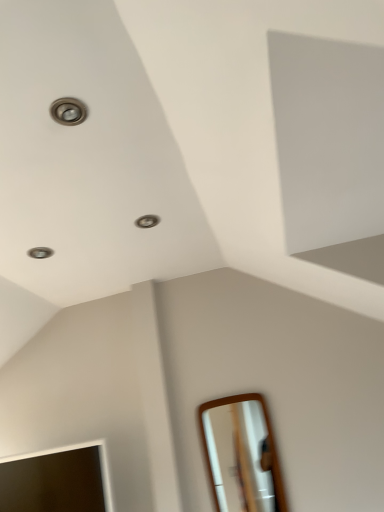
Question: Can you confirm if white glossy mirror at lower right, marked as the first mirror in a right-to-left arrangement, is thinner than matte wooden mirror at lower left, placed as the second mirror when sorted from right to left?

Choices:
 (A) yes
 (B) no

Answer: (A)

Question: Can you confirm if white glossy mirror at lower right, the second mirror viewed from the left, is positioned to the left of matte wooden mirror at lower left, which is the first mirror in left-to-right order?

Choices:
 (A) no
 (B) yes

Answer: (A)

Question: From a real-world perspective, is white glossy mirror at lower right, marked as the first mirror in a right-to-left arrangement, under matte wooden mirror at lower left, placed as the second mirror when sorted from right to left?

Choices:
 (A) yes
 (B) no

Answer: (A)

Question: Can you confirm if white glossy mirror at lower right, marked as the first mirror in a right-to-left arrangement, is positioned to the right of matte wooden mirror at lower left, which is the first mirror in left-to-right order?

Choices:
 (A) yes
 (B) no

Answer: (A)

Question: From a real-world perspective, is white glossy mirror at lower right, marked as the first mirror in a right-to-left arrangement, over matte wooden mirror at lower left, placed as the second mirror when sorted from right to left?

Choices:
 (A) no
 (B) yes

Answer: (A)

Question: From the image's perspective, is white glossy mirror at lower right, marked as the first mirror in a right-to-left arrangement, over matte wooden mirror at lower left, which is the first mirror in left-to-right order?

Choices:
 (A) no
 (B) yes

Answer: (B)

Question: Is matte wooden mirror at lower left, which is the first mirror in left-to-right order, thinner than white glossy mirror at lower right, the second mirror viewed from the left?

Choices:
 (A) yes
 (B) no

Answer: (B)

Question: Can we say matte wooden mirror at lower left, which is the first mirror in left-to-right order, lies outside white glossy mirror at lower right, the second mirror viewed from the left?

Choices:
 (A) yes
 (B) no

Answer: (A)

Question: Considering the relative positions of matte wooden mirror at lower left, placed as the second mirror when sorted from right to left, and white glossy mirror at lower right, marked as the first mirror in a right-to-left arrangement, in the image provided, is matte wooden mirror at lower left, placed as the second mirror when sorted from right to left, in front of white glossy mirror at lower right, marked as the first mirror in a right-to-left arrangement,?

Choices:
 (A) yes
 (B) no

Answer: (A)

Question: From the image's perspective, would you say matte wooden mirror at lower left, placed as the second mirror when sorted from right to left, is shown under white glossy mirror at lower right, marked as the first mirror in a right-to-left arrangement?

Choices:
 (A) yes
 (B) no

Answer: (A)

Question: Is matte wooden mirror at lower left, placed as the second mirror when sorted from right to left, oriented away from white glossy mirror at lower right, the second mirror viewed from the left?

Choices:
 (A) no
 (B) yes

Answer: (A)

Question: Is matte wooden mirror at lower left, which is the first mirror in left-to-right order, far from white glossy mirror at lower right, marked as the first mirror in a right-to-left arrangement?

Choices:
 (A) yes
 (B) no

Answer: (A)

Question: Relative to matte wooden mirror at lower left, placed as the second mirror when sorted from right to left, is white glossy mirror at lower right, the second mirror viewed from the left, in front or behind?

Choices:
 (A) behind
 (B) front

Answer: (A)